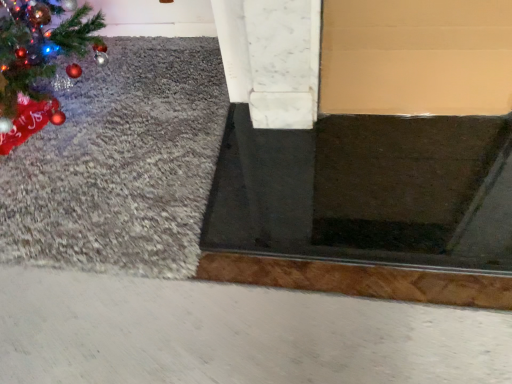
Question: Based on their sizes in the image, would you say gray shag rug at left is bigger or smaller than black rubber doormat at center?

Choices:
 (A) small
 (B) big

Answer: (B)

Question: From a real-world perspective, is gray shag rug at left positioned above or below black rubber doormat at center?

Choices:
 (A) below
 (B) above

Answer: (A)

Question: Is gray shag rug at left wider or thinner than black rubber doormat at center?

Choices:
 (A) wide
 (B) thin

Answer: (A)

Question: Is black rubber doormat at center wider or thinner than gray shag rug at left?

Choices:
 (A) wide
 (B) thin

Answer: (B)

Question: From the image's perspective, relative to gray shag rug at left, is black rubber doormat at center above or below?

Choices:
 (A) below
 (B) above

Answer: (A)

Question: Is black rubber doormat at center inside the boundaries of gray shag rug at left, or outside?

Choices:
 (A) outside
 (B) inside

Answer: (A)

Question: From their relative heights in the image, would you say black rubber doormat at center is taller or shorter than gray shag rug at left?

Choices:
 (A) tall
 (B) short

Answer: (A)